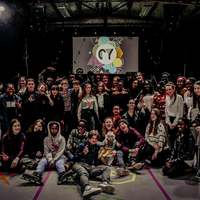
Locate an element on the screen. yellow circle on floor is located at coordinates (115, 177).